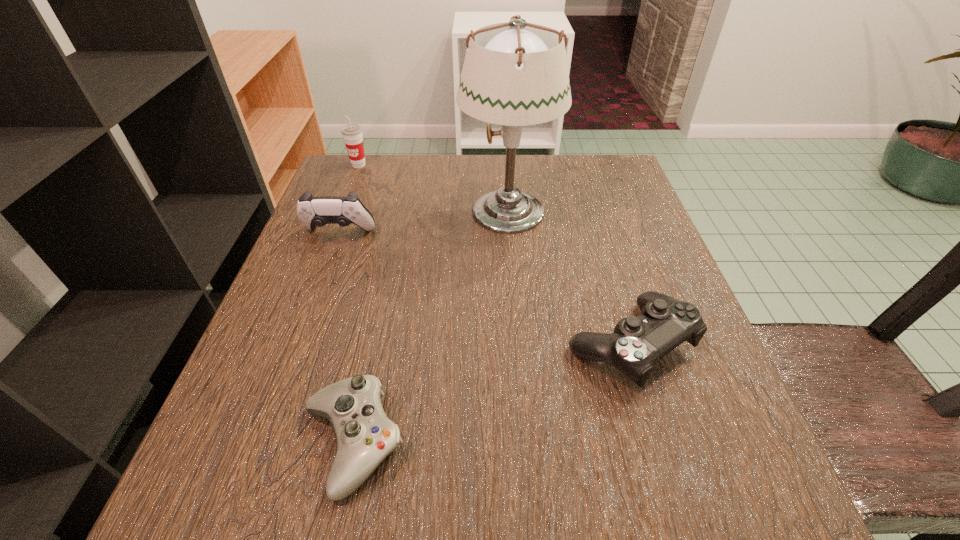
This screenshot has width=960, height=540. Find the location of `vacant region that satisfies the following two spatial constraints: 1. on the front-facing side of the farthest control; 2. on the left side of the shortest object`. vacant region that satisfies the following two spatial constraints: 1. on the front-facing side of the farthest control; 2. on the left side of the shortest object is located at coordinates (262, 443).

Find the location of a particular element. Image resolution: width=960 pixels, height=540 pixels. free space in the image that satisfies the following two spatial constraints: 1. on the side of the shortest control with the logo; 2. on the left side of the second tallest object is located at coordinates tap(252, 443).

Locate an element on the screen. This screenshot has height=540, width=960. free space that satisfies the following two spatial constraints: 1. on the side of the shortest control with the logo; 2. on the left side of the farthest object is located at coordinates (252, 443).

Identify the location of vacant position in the image that satisfies the following two spatial constraints: 1. on the side of the cup with the logo; 2. on the left side of the rightmost control. (289, 345).

At what (x,y) coordinates should I click in order to perform the action: click on vacant area that satisfies the following two spatial constraints: 1. on the side of the cup with the logo; 2. on the left side of the rightmost control. Please return your answer as a coordinate pair (x, y). Image resolution: width=960 pixels, height=540 pixels. Looking at the image, I should click on (289, 345).

Identify the location of vacant region that satisfies the following two spatial constraints: 1. on the lampshade of the lampshade; 2. on the back side of the rightmost control. (518, 345).

The width and height of the screenshot is (960, 540). In order to click on free region that satisfies the following two spatial constraints: 1. on the front-facing side of the farthest control; 2. on the right side of the shortest control in this screenshot , I will do `click(262, 443)`.

Find the location of `vacant space that satisfies the following two spatial constraints: 1. on the lampshade of the rightmost control; 2. on the right side of the tallest object`. vacant space that satisfies the following two spatial constraints: 1. on the lampshade of the rightmost control; 2. on the right side of the tallest object is located at coordinates (518, 345).

You are a GUI agent. You are given a task and a screenshot of the screen. Output one action in this format:
    pyautogui.click(x=<x>, y=<y>)
    Task: Click on the vacant space that satisfies the following two spatial constraints: 1. on the lampshade of the lampshade; 2. on the front side of the shortest object
    
    Given the screenshot: What is the action you would take?
    pyautogui.click(x=526, y=443)